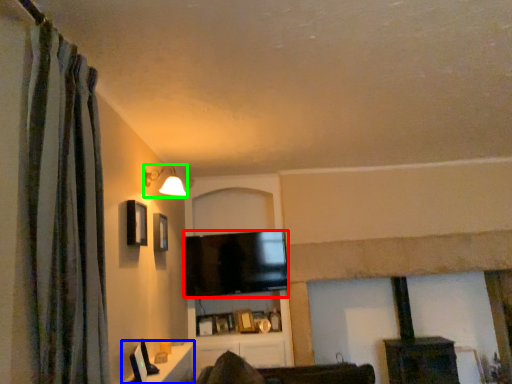
Question: Which object is positioned closest to television (highlighted by a red box)? Select from table (highlighted by a blue box) and light fixture (highlighted by a green box).

Choices:
 (A) table
 (B) light fixture

Answer: (B)